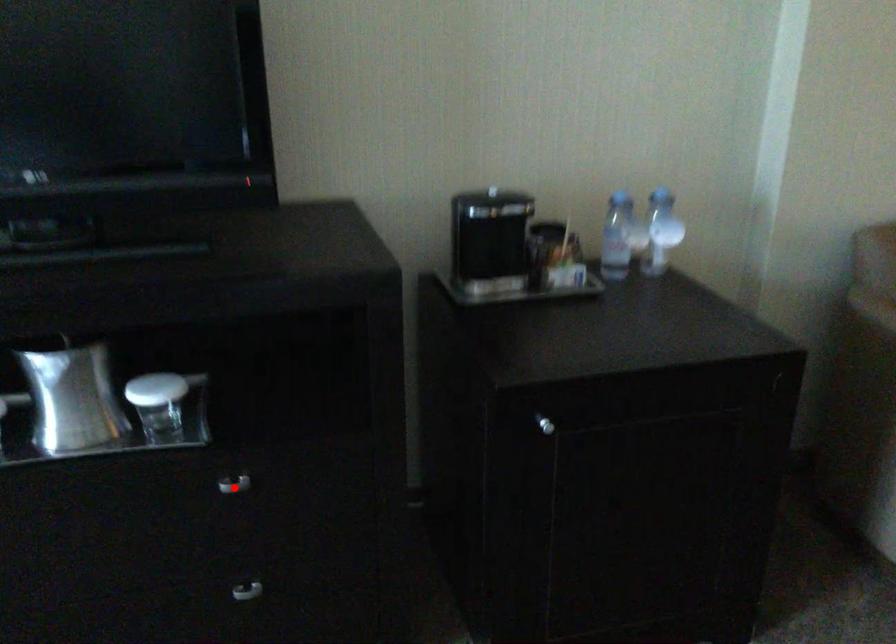
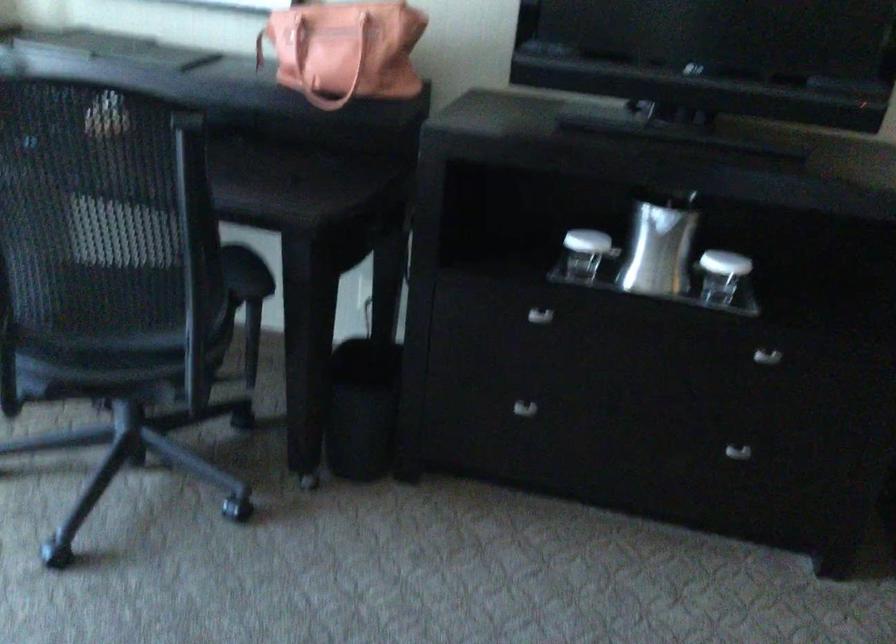
Question: I am providing you with two images of the same scene from different viewpoints. A red point is shown in image1. For the corresponding object point in image2, is it positioned nearer or farther from the camera?

Choices:
 (A) Nearer
 (B) Farther

Answer: (B)